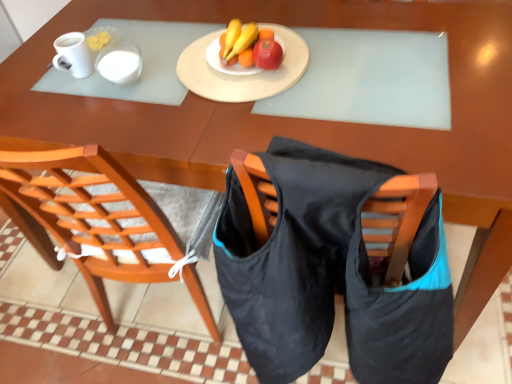
The width and height of the screenshot is (512, 384). Describe the element at coordinates (110, 219) in the screenshot. I see `wooden chair at center` at that location.

Image resolution: width=512 pixels, height=384 pixels. In order to click on matte white plate at center in this screenshot , I will do coord(242,75).

Where is `wooden chair at center`? Image resolution: width=512 pixels, height=384 pixels. wooden chair at center is located at coordinates (110, 219).

Which of these two, white glossy mug at upper left or wooden chair at center, stands taller?

Standing taller between the two is wooden chair at center.

From the picture: Is white glossy mug at upper left wider than wooden chair at center?

In fact, white glossy mug at upper left might be narrower than wooden chair at center.

Considering the points (96, 68) and (151, 222), which point is behind, point (96, 68) or point (151, 222)?

The point (96, 68) is farther.

Can you confirm if white glossy mug at upper left is positioned to the right of wooden chair at center?

Incorrect, white glossy mug at upper left is not on the right side of wooden chair at center.

From the picture: Does matte red apple at center turn towards matte white plate at center?

No, matte red apple at center does not turn towards matte white plate at center.

In the scene shown: How different are the orientations of matte red apple at center and matte white plate at center in degrees?

The angular difference between matte red apple at center and matte white plate at center is 180 degrees.

From the image's perspective, which is above, matte red apple at center or matte white plate at center?

From the image's view, matte white plate at center is above.

Based on the photo, considering the sizes of matte yellow banana at center and white glossy mug at upper left in the image, is matte yellow banana at center bigger or smaller than white glossy mug at upper left?

matte yellow banana at center is bigger than white glossy mug at upper left.

Measure the distance between matte yellow banana at center and white glossy mug at upper left.

17.89 inches.

From a real-world perspective, which object stands above the other?

From a 3D spatial view, white glossy mug at upper left is above.

Is matte yellow banana at center beside white glossy mug at upper left?

No.

Is wooden chair at center turned away from matte red apple at center?

No, wooden chair at center's orientation is not away from matte red apple at center.

Where is `chair on the left of the matte red apple at center`? The height and width of the screenshot is (384, 512). chair on the left of the matte red apple at center is located at coordinates (110, 219).

Considering the sizes of wooden chair at center and matte red apple at center in the image, is wooden chair at center taller or shorter than matte red apple at center?

Considering their sizes, wooden chair at center has more height than matte red apple at center.

Between matte white plate at center and wooden chair at center, which one has more height?

wooden chair at center is taller.

From a real-world perspective, between matte white plate at center and wooden chair at center, who is vertically higher?

matte white plate at center.

How distant is matte white plate at center from wooden chair at center?

matte white plate at center and wooden chair at center are 16.58 inches apart.

Considering the relative sizes of matte white plate at center and wooden chair at center in the image provided, is matte white plate at center bigger than wooden chair at center?

Actually, matte white plate at center might be smaller than wooden chair at center.

Considering the positions of objects white glossy mug at upper left and matte yellow banana at center in the image provided, who is in front, white glossy mug at upper left or matte yellow banana at center?

matte yellow banana at center.

From the image's perspective, is white glossy mug at upper left located above or below matte yellow banana at center?

Based on their image positions, white glossy mug at upper left is located beneath matte yellow banana at center.

Is point (62, 44) closer to viewer compared to point (240, 57)?

No, (62, 44) is further to viewer.

Could you tell me if white glossy mug at upper left is turned towards matte white plate at center?

No, white glossy mug at upper left is not turned towards matte white plate at center.

Based on the photo, relative to matte white plate at center, is white glossy mug at upper left in front or behind?

Visually, white glossy mug at upper left is located behind matte white plate at center.

From the image's perspective, between white glossy mug at upper left and matte white plate at center, who is located below?

matte white plate at center, from the image's perspective.

Can you tell me how much white glossy mug at upper left and matte white plate at center differ in facing direction?

The angular difference between white glossy mug at upper left and matte white plate at center is 180 degrees.

At what (x,y) coordinates should I click in order to perform the action: click on mug behind the wooden chair at center. Please return your answer as a coordinate pair (x, y). This screenshot has height=384, width=512. Looking at the image, I should click on (120, 63).

This screenshot has width=512, height=384. Identify the location of plate directly beneath the matte red apple at center (from a real-world perspective). (242, 75).

Considering their positions, is wooden chair at center positioned further to matte yellow banana at center than white glossy mug at upper left?

wooden chair at center lies further to matte yellow banana at center than the other object.

Which object lies further to the anchor point wooden chair at center, matte yellow banana at center or matte white plate at center?

matte yellow banana at center is further to wooden chair at center.

Based on their spatial positions, is matte white plate at center or matte yellow banana at center further from white glossy mug at upper left?

matte yellow banana at center is further to white glossy mug at upper left.

Estimate the real-world distances between objects in this image. Which object is further from white glossy mug at upper left, white glossy mug at upper left or wooden chair at center?

wooden chair at center lies further to white glossy mug at upper left than the other object.

Based on their spatial positions, is white glossy mug at upper left or white glossy mug at upper left closer to matte yellow banana at center?

The object closer to matte yellow banana at center is white glossy mug at upper left.

Which object lies further to the anchor point matte yellow banana at center, white glossy mug at upper left or wooden chair at center?

The object further to matte yellow banana at center is wooden chair at center.

When comparing their distances from matte white plate at center, does matte yellow banana at center or white glossy mug at upper left seem closer?

matte yellow banana at center.

Which object lies further to the anchor point matte white plate at center, white glossy mug at upper left or matte yellow banana at center?

white glossy mug at upper left is further to matte white plate at center.

Find the location of a particular element. The height and width of the screenshot is (384, 512). apple between white glossy mug at upper left and wooden chair at center in the up-down direction is located at coordinates (x=267, y=54).

Where is `banana located between white glossy mug at upper left and matte red apple at center in the left-right direction`? banana located between white glossy mug at upper left and matte red apple at center in the left-right direction is located at coordinates (252, 48).

Image resolution: width=512 pixels, height=384 pixels. I want to click on mug between matte white plate at center and wooden chair at center vertically, so click(120, 63).

Locate an element on the screen. This screenshot has width=512, height=384. plate between white glossy mug at upper left and matte yellow banana at center in the horizontal direction is located at coordinates (242, 75).